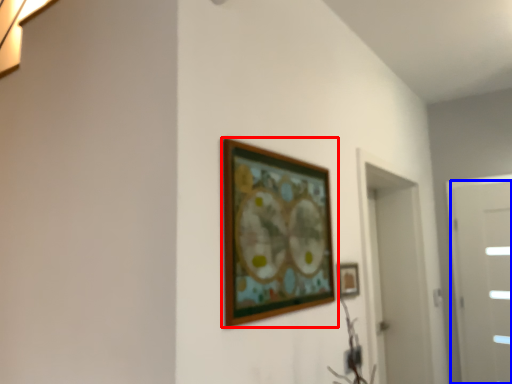
Question: Which point is further to the camera, picture frame (highlighted by a red box) or door (highlighted by a blue box)?

Choices:
 (A) picture frame
 (B) door

Answer: (B)